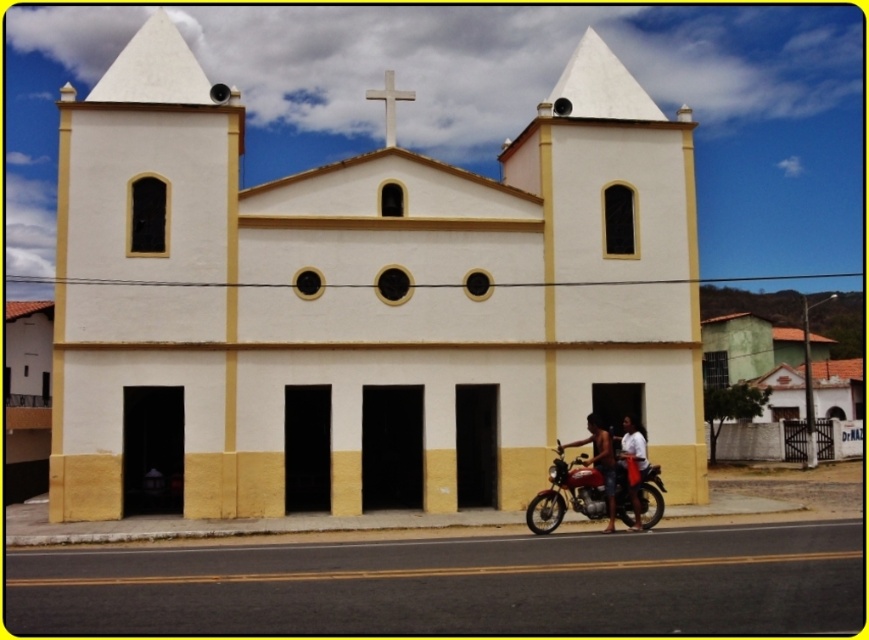
You are a fashion designer observing a model wearing a white cotton shirt at center and tan shorts at lower center. You need to create a new outfit that complements the existing clothing. Considering the spatial arrangement between the two items, what adjustment would you make to ensure proper fit and proportion?

The distance between the white cotton shirt at center and tan shorts at lower center is 15.96 inches. To ensure proper fit and proportion, adjust the length of the shirt so it reaches just above the shorts, maintaining a balanced look without overlapping excessively.

You are standing at the entrance of the white church with two bell towers. You notice two points marked on the ground in front of you. One is at coordinate point (601,442) and the other is at point (385,108). Which point is closer to the church?

Point (601,442) is in front of point (385,108), so point (601,442) is closer to the church.